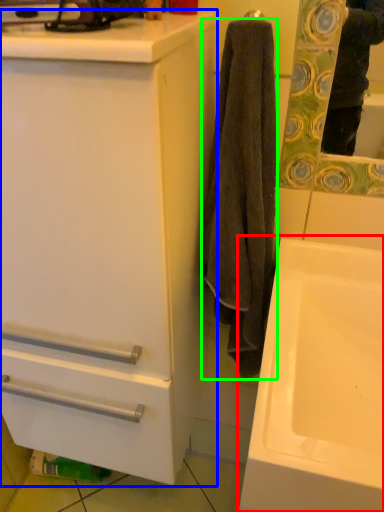
Question: Based on their relative distances, which object is nearer to sink (highlighted by a red box)? Choose from bathroom cabinet (highlighted by a blue box) and towel/napkin (highlighted by a green box).

Choices:
 (A) bathroom cabinet
 (B) towel/napkin

Answer: (B)